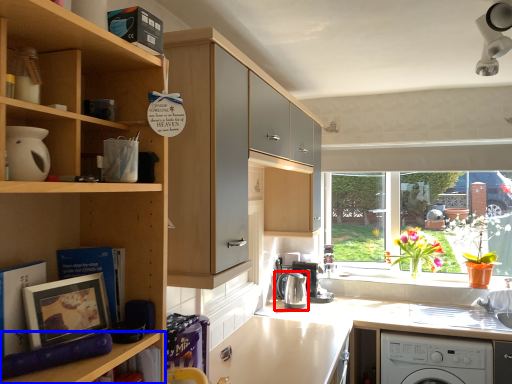
Question: Which of the following is the closest to the observer, kitchen appliance (highlighted by a red box) or shelf (highlighted by a blue box)?

Choices:
 (A) kitchen appliance
 (B) shelf

Answer: (B)